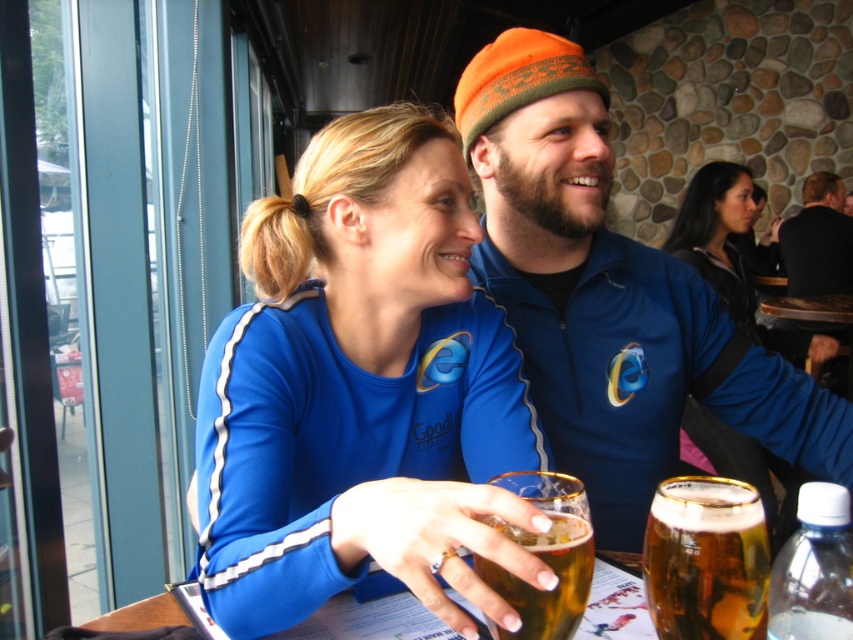
Question: Which point is farther from the camera taking this photo?

Choices:
 (A) (831, 208)
 (B) (566, 564)
 (C) (477, 401)
 (D) (592, 518)

Answer: (A)

Question: Which of the following is the farthest from the observer?

Choices:
 (A) tap(830, 285)
 (B) tap(343, 305)
 (C) tap(740, 556)

Answer: (A)

Question: Considering the real-world distances, which object is closest to the amber glass at center?

Choices:
 (A) blue fleece jacket at center
 (B) black fleece jacket at upper right
 (C) translucent glass beer at center
 (D) blue fabric shirt at center

Answer: (C)

Question: Considering the relative positions of translucent glass beer at center and black fleece jacket at upper right in the image provided, where is translucent glass beer at center located with respect to black fleece jacket at upper right?

Choices:
 (A) above
 (B) below

Answer: (B)

Question: Is blue fabric shirt at center positioned in front of amber glass at center?

Choices:
 (A) yes
 (B) no

Answer: (A)

Question: Does translucent glass beer at center have a smaller size compared to black fleece jacket at upper right?

Choices:
 (A) yes
 (B) no

Answer: (A)